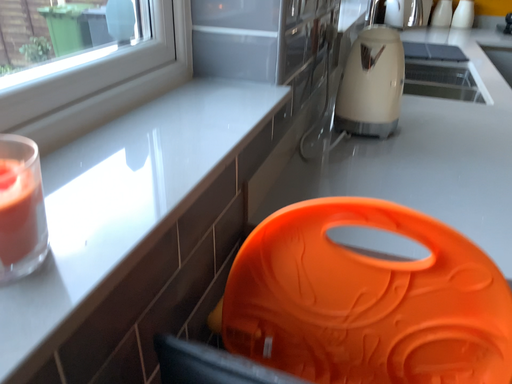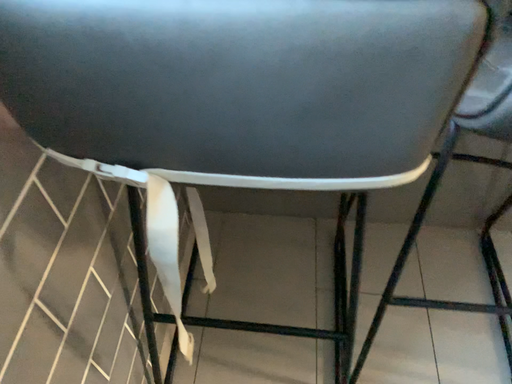
Question: Which way did the camera rotate in the video?

Choices:
 (A) rotated downward
 (B) rotated upward

Answer: (A)